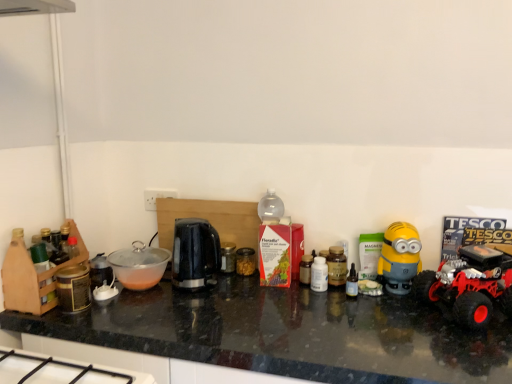
You are a GUI agent. You are given a task and a screenshot of the screen. Output one action in this format:
    pyautogui.click(x=<x>, y=<y>)
    Task: Click on the vacant area that is in front of transparent plastic bowl at center
    
    Given the screenshot: What is the action you would take?
    tap(148, 302)